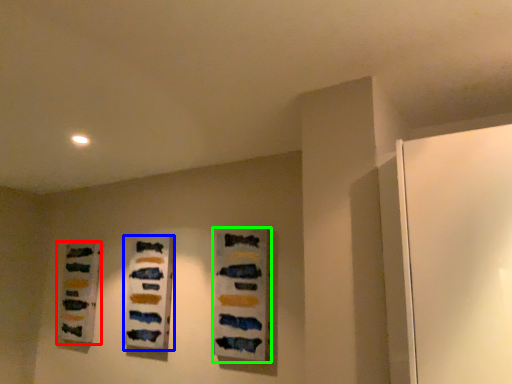
Question: Based on their relative distances, which object is farther from art (highlighted by a red box)? Choose from art (highlighted by a blue box) and art (highlighted by a green box).

Choices:
 (A) art
 (B) art

Answer: (B)